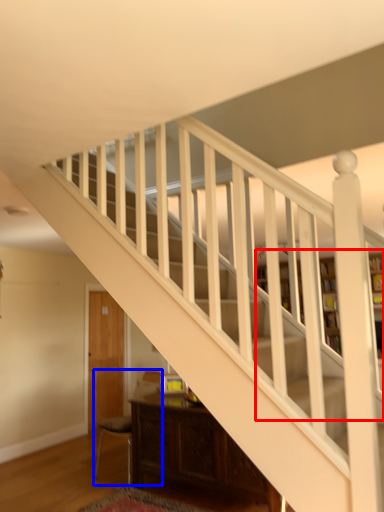
Question: Which point is further to the camera, bookcase (highlighted by a red box) or armchair (highlighted by a blue box)?

Choices:
 (A) bookcase
 (B) armchair

Answer: (A)